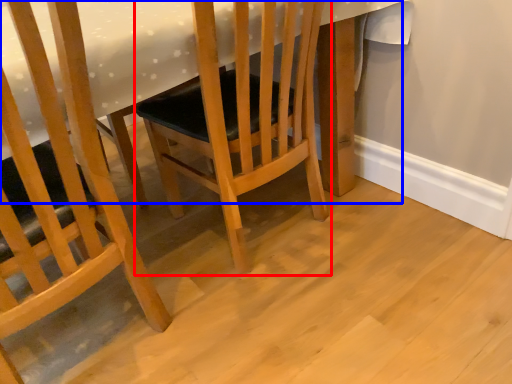
Question: Which point is closer to the camera, chair (highlighted by a red box) or table (highlighted by a blue box)?

Choices:
 (A) chair
 (B) table

Answer: (B)